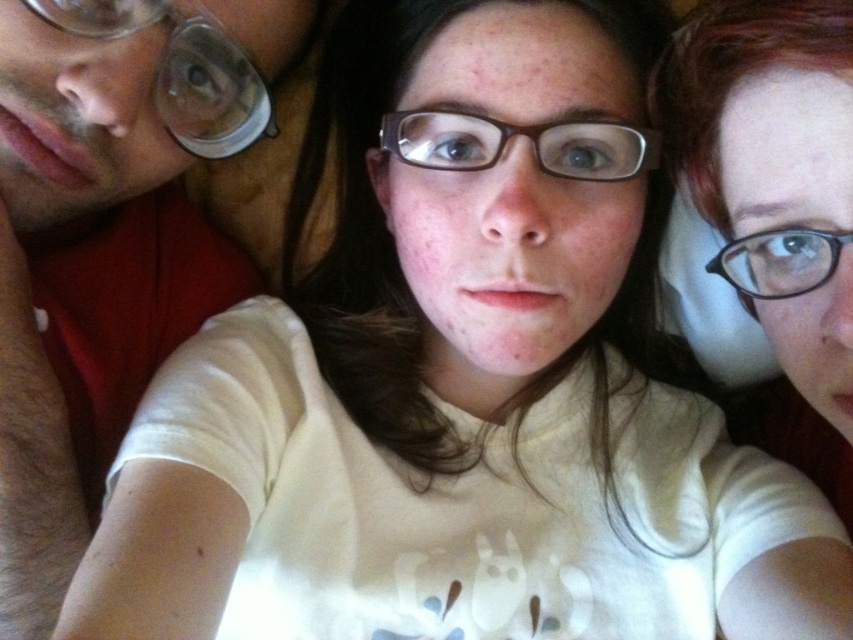
You are a photographer trying to capture a candid shot of the brown plastic glasses at center without including the matte red shirt at left in the frame. Given their positions, is this possible?

The matte red shirt at left is in front of the brown plastic glasses at center, so it would block the view. Therefore, it is not possible to capture the brown plastic glasses at center without including the matte red shirt at left in the frame.